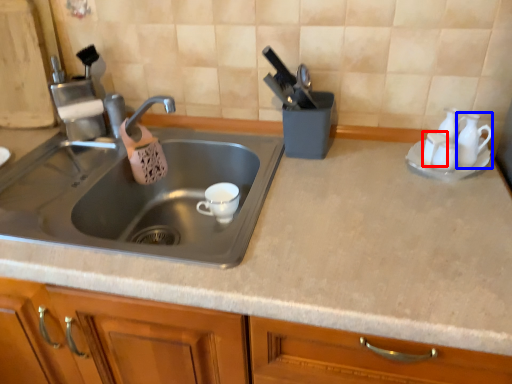
Question: Which object is closer to the camera taking this photo, tableware (highlighted by a red box) or tableware (highlighted by a blue box)?

Choices:
 (A) tableware
 (B) tableware

Answer: (B)